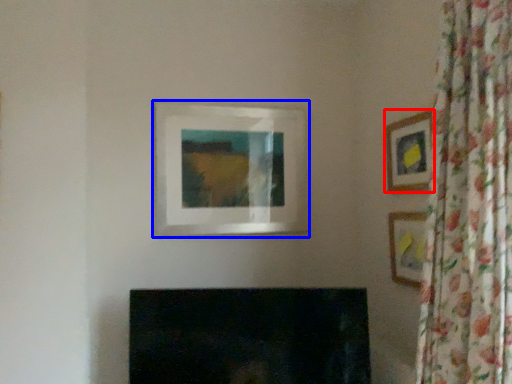
Question: Which object appears farthest to the camera in this image, picture frame (highlighted by a red box) or picture frame (highlighted by a blue box)?

Choices:
 (A) picture frame
 (B) picture frame

Answer: (B)